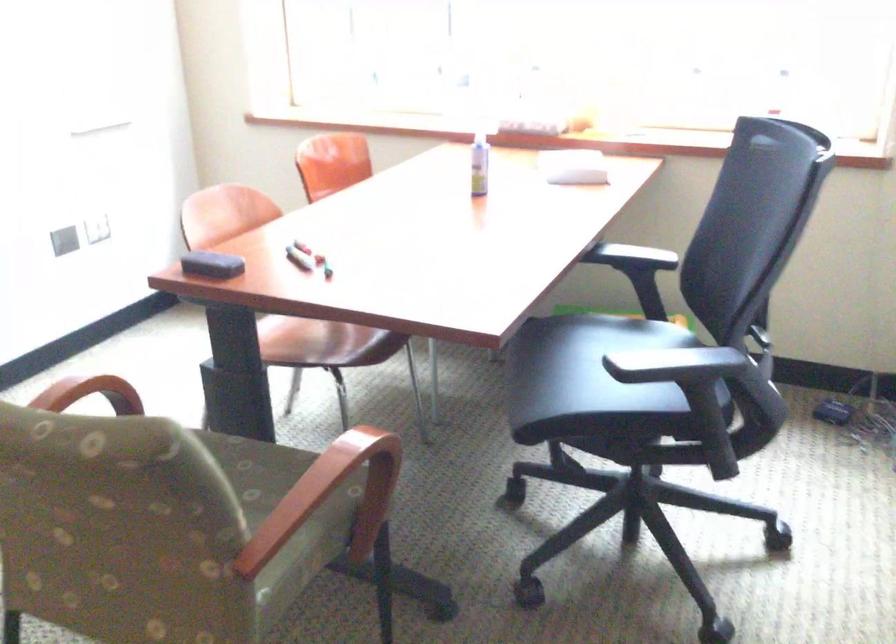
What do you see at coordinates (251, 469) in the screenshot?
I see `the patterned chair sitting surface` at bounding box center [251, 469].